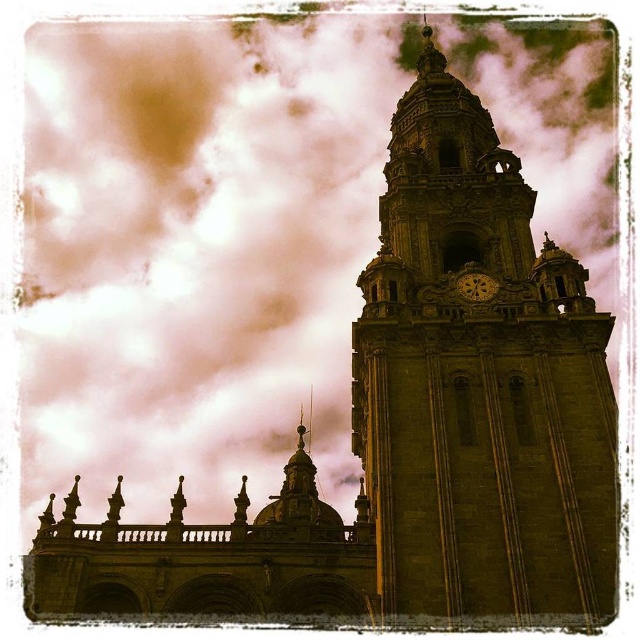
Question: Which point is farther to the camera?

Choices:
 (A) gold textured clock at upper center
 (B) green stone clock tower at upper right

Answer: (A)

Question: Which point is closer to the camera?

Choices:
 (A) green stone clock tower at upper right
 (B) gold textured clock at upper center

Answer: (A)

Question: Does green stone clock tower at upper right have a greater width compared to gold textured clock at upper center?

Choices:
 (A) yes
 (B) no

Answer: (A)

Question: Is green stone clock tower at upper right bigger than gold textured clock at upper center?

Choices:
 (A) yes
 (B) no

Answer: (A)

Question: From the image, what is the correct spatial relationship of green stone clock tower at upper right in relation to gold textured clock at upper center?

Choices:
 (A) below
 (B) above

Answer: (B)